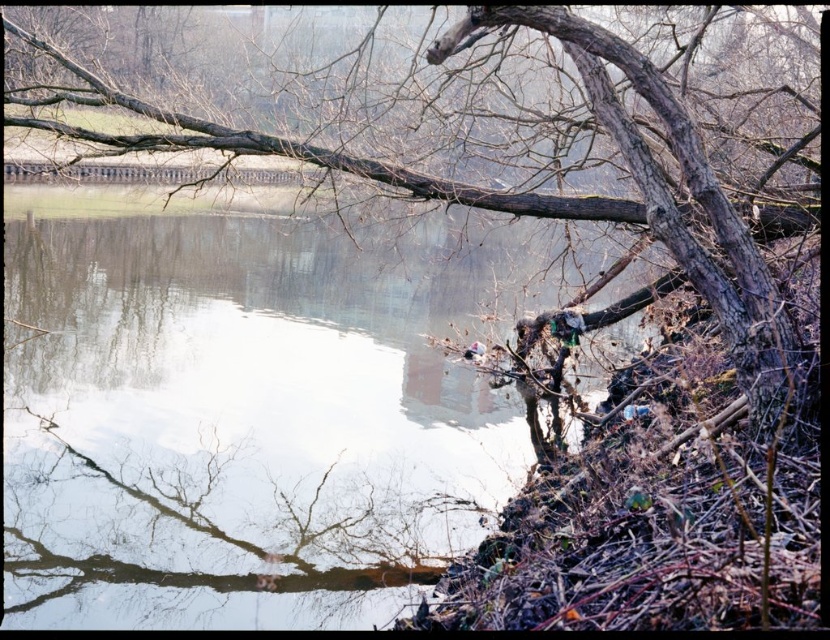
Question: Can you confirm if clear water at lower left is thinner than brown rough tree at upper right?

Choices:
 (A) no
 (B) yes

Answer: (A)

Question: Does clear water at lower left have a smaller size compared to brown rough tree at upper right?

Choices:
 (A) no
 (B) yes

Answer: (A)

Question: Does clear water at lower left appear under brown rough tree at upper right?

Choices:
 (A) yes
 (B) no

Answer: (A)

Question: Among these points, which one is nearest to the camera?

Choices:
 (A) (622, 48)
 (B) (67, 371)

Answer: (A)